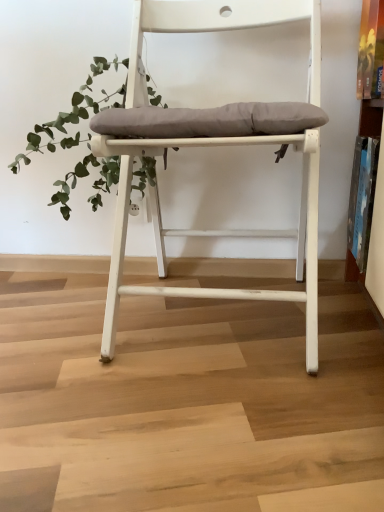
Question: From the image's perspective, does white matte chair at center appear lower than green leafy plant at upper left?

Choices:
 (A) no
 (B) yes

Answer: (B)

Question: Can you confirm if white matte chair at center is thinner than green leafy plant at upper left?

Choices:
 (A) yes
 (B) no

Answer: (B)

Question: Considering the relative sizes of white matte chair at center and green leafy plant at upper left in the image provided, is white matte chair at center shorter than green leafy plant at upper left?

Choices:
 (A) yes
 (B) no

Answer: (B)

Question: Is white matte chair at center turned away from green leafy plant at upper left?

Choices:
 (A) no
 (B) yes

Answer: (A)

Question: From a real-world perspective, is white matte chair at center located higher than green leafy plant at upper left?

Choices:
 (A) no
 (B) yes

Answer: (A)

Question: Considering the relative sizes of white matte chair at center and green leafy plant at upper left in the image provided, is white matte chair at center bigger than green leafy plant at upper left?

Choices:
 (A) yes
 (B) no

Answer: (A)

Question: From a real-world perspective, is green leafy plant at upper left physically below white matte chair at center?

Choices:
 (A) yes
 (B) no

Answer: (B)

Question: Is green leafy plant at upper left aimed at white matte chair at center?

Choices:
 (A) yes
 (B) no

Answer: (B)

Question: Is green leafy plant at upper left thinner than white matte chair at center?

Choices:
 (A) yes
 (B) no

Answer: (A)

Question: Considering the relative sizes of green leafy plant at upper left and white matte chair at center in the image provided, is green leafy plant at upper left wider than white matte chair at center?

Choices:
 (A) no
 (B) yes

Answer: (A)

Question: From the image's perspective, is green leafy plant at upper left located above white matte chair at center?

Choices:
 (A) yes
 (B) no

Answer: (A)

Question: Considering the relative sizes of green leafy plant at upper left and white matte chair at center in the image provided, is green leafy plant at upper left shorter than white matte chair at center?

Choices:
 (A) yes
 (B) no

Answer: (A)

Question: From the image's perspective, is green leafy plant at upper left positioned above or below white matte chair at center?

Choices:
 (A) above
 (B) below

Answer: (A)